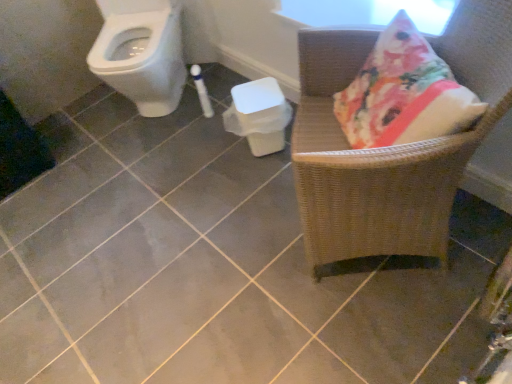
At what (x,y) coordinates should I click in order to perform the action: click on free spot in front of white plastic potty at center. Please return your answer as a coordinate pair (x, y). Looking at the image, I should click on (259, 180).